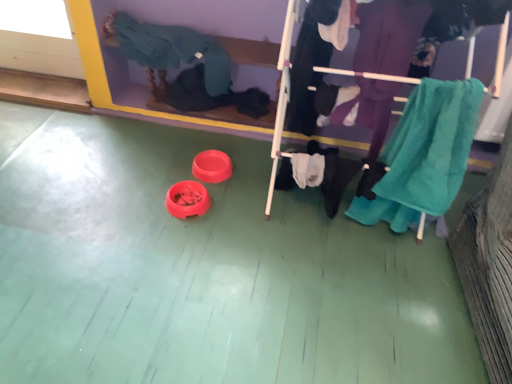
Find the location of a particular element. The width and height of the screenshot is (512, 384). vacant area to the left of teal fabric clothes rack at center is located at coordinates (225, 210).